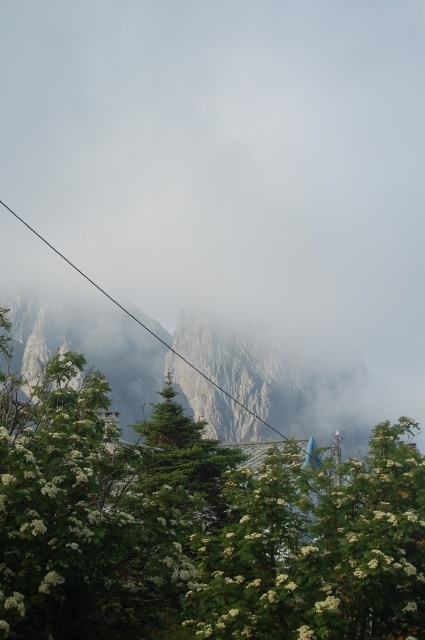
Between foggy misty mountain at upper center and green leafy tree at center, which one has more height?

foggy misty mountain at upper center is taller.

Between point (184, 193) and point (110, 632), which one is positioned behind?

Positioned behind is point (184, 193).

Where is `foggy misty mountain at upper center`? The width and height of the screenshot is (425, 640). foggy misty mountain at upper center is located at coordinates (237, 172).

Who is higher up, foggy misty mountain at upper center or green matte tree at center?

foggy misty mountain at upper center is above.

Between point (190, 192) and point (166, 445), which one is positioned behind?

The point (190, 192) is more distant.

You are a GUI agent. You are given a task and a screenshot of the screen. Output one action in this format:
    pyautogui.click(x=<x>, y=<y>)
    Task: Click on the foggy misty mountain at upper center
    The width and height of the screenshot is (425, 640).
    Given the screenshot: What is the action you would take?
    pyautogui.click(x=237, y=172)

Is point (187, 486) positioned after point (34, 228)?

No, it is not.

Which is below, green matte tree at center or black wire at upper center?

green matte tree at center is lower down.

Does point (212, 448) come closer to viewer compared to point (212, 378)?

Yes, it is.

Image resolution: width=425 pixels, height=640 pixels. What are the coordinates of `green matte tree at center` in the screenshot? It's located at (186, 454).